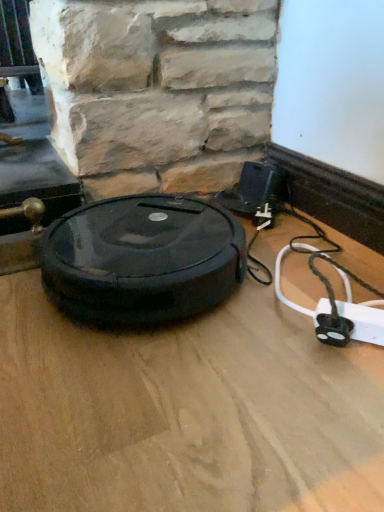
You are a GUI agent. You are given a task and a screenshot of the screen. Output one action in this format:
    pyautogui.click(x=<x>, y=<y>)
    Task: Click on the free space to the left of white plastic extension cord at lower right
    
    Given the screenshot: What is the action you would take?
    pyautogui.click(x=257, y=362)